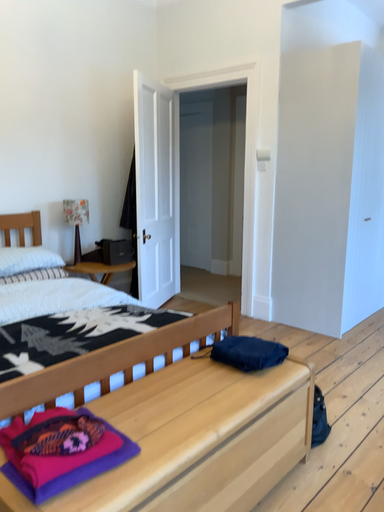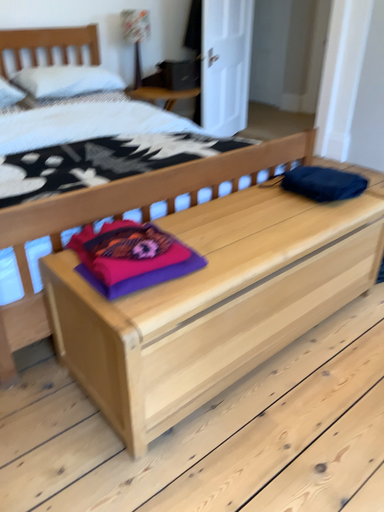
Question: How did the camera likely rotate when shooting the video?

Choices:
 (A) rotated downward
 (B) rotated upward

Answer: (A)